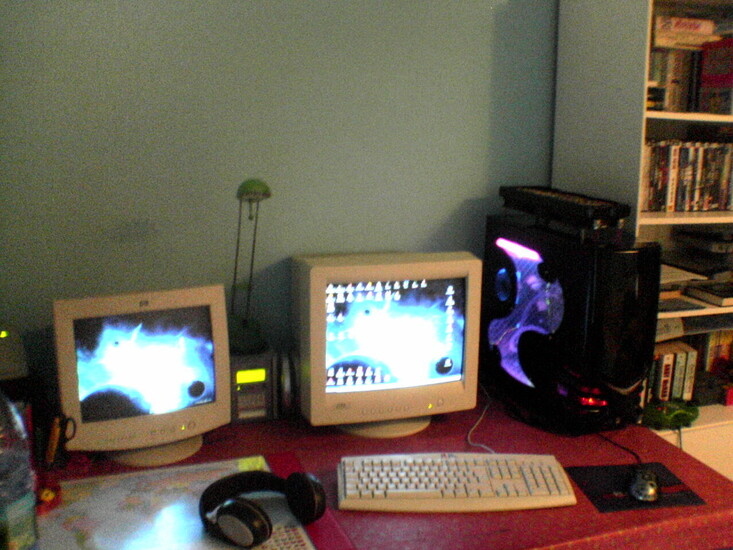
What are the coordinates of `computer tower` in the screenshot? It's located at (580, 309).